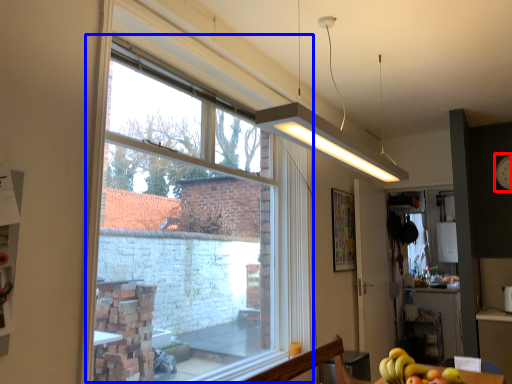
Question: Which point is closer to the camera, clock (highlighted by a red box) or window (highlighted by a blue box)?

Choices:
 (A) clock
 (B) window

Answer: (B)